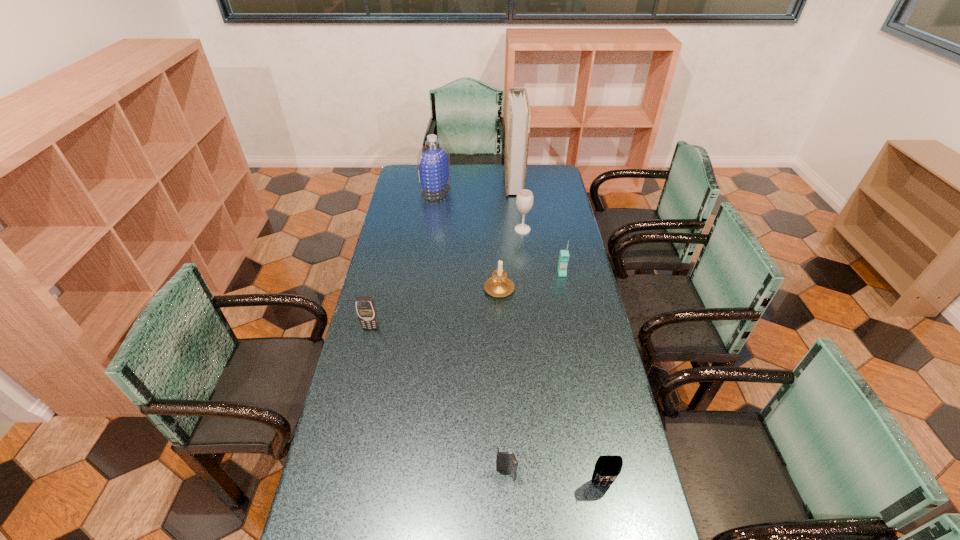
The width and height of the screenshot is (960, 540). What are the coordinates of `vacant region located 0.380m with a handle on the side of the candle holder` in the screenshot? It's located at (496, 221).

At what (x,y) coordinates should I click in order to perform the action: click on free space located 0.050m on the keyboard of the third cellular telephone from right to left. Please return your answer as a coordinate pair (x, y). Image resolution: width=960 pixels, height=540 pixels. Looking at the image, I should click on (508, 500).

Identify the location of phonebook that is at the far edge. Image resolution: width=960 pixels, height=540 pixels. (518, 114).

Find the location of a particular element. cleansing agent positioned at the far edge is located at coordinates (433, 161).

Where is `cleansing agent located at the left edge`? cleansing agent located at the left edge is located at coordinates (433, 161).

Identify the location of cellular telephone located in the left edge section of the desktop. (x=365, y=306).

The image size is (960, 540). I want to click on object at the far left corner, so click(x=433, y=161).

Where is `free spot at the far edge of the desktop`? The image size is (960, 540). free spot at the far edge of the desktop is located at coordinates (462, 166).

The image size is (960, 540). I want to click on free space at the left edge of the desktop, so click(x=405, y=202).

Identify the location of vacant space at the right edge. (578, 280).